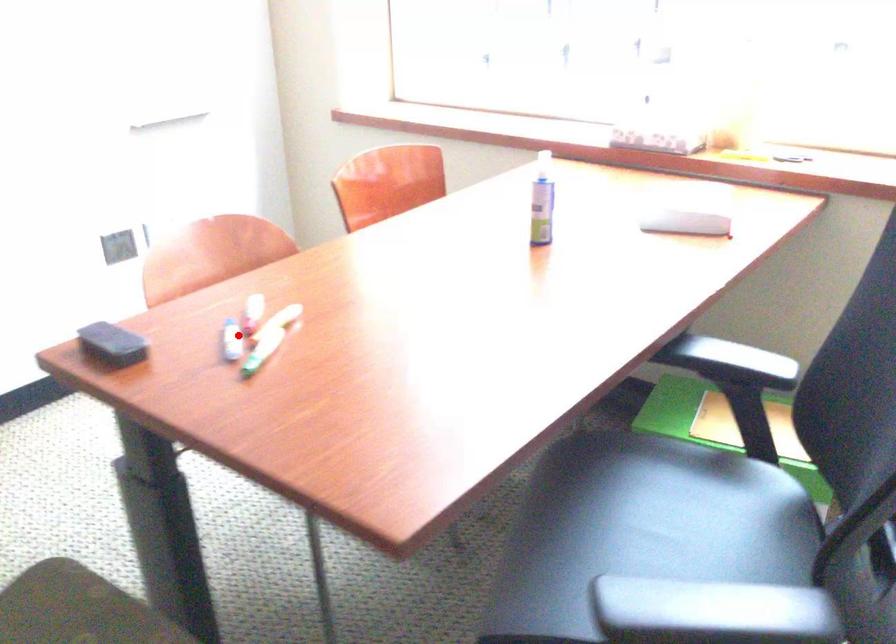
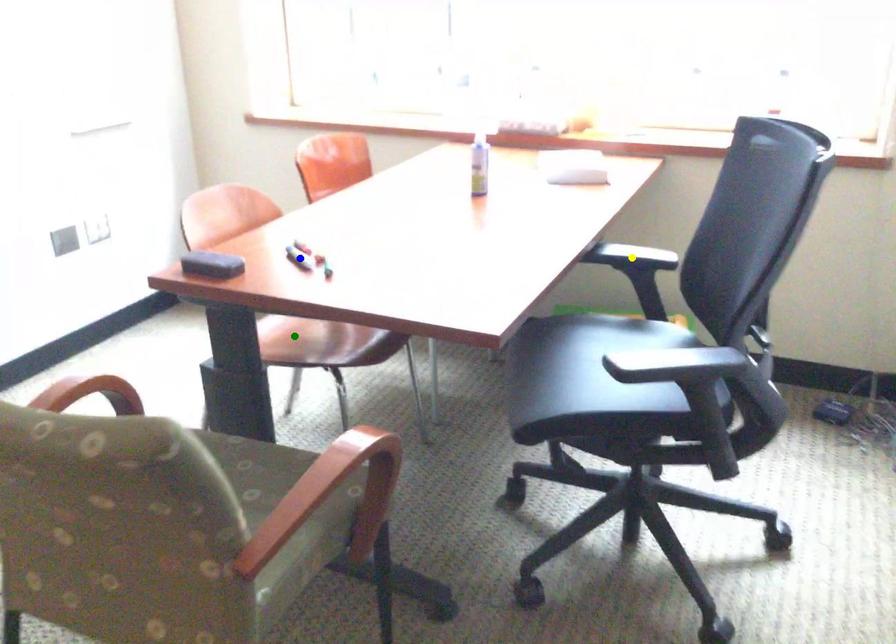
Question: I am providing you with two images of the same scene from different viewpoints. A red point is marked on the first image. You are given multiple points on the second image. Which spot in image 2 lines up with the point in image 1?

Choices:
 (A) yellow point
 (B) blue point
 (C) green point

Answer: (B)